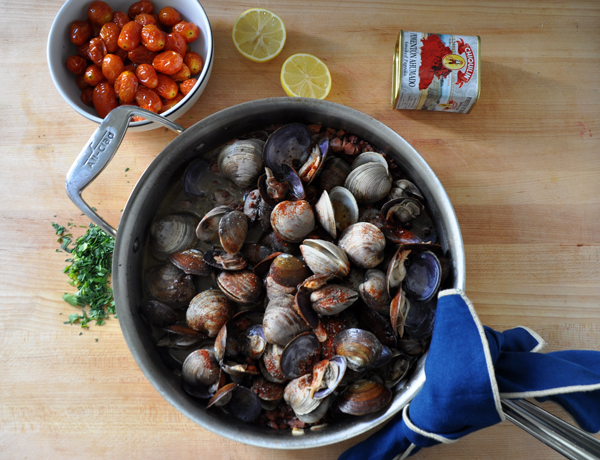
Where is `all-clad secondary handle of pot`? all-clad secondary handle of pot is located at coordinates (93, 163).